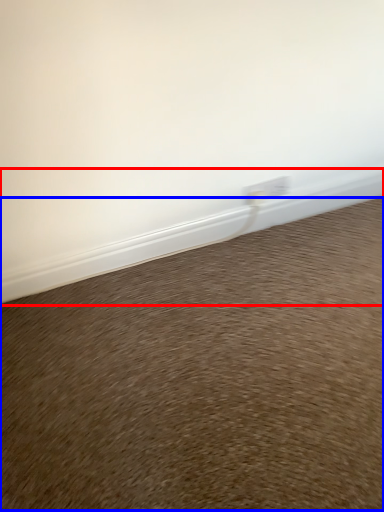
Question: Which object is further to the camera taking this photo, window sill (highlighted by a red box) or sand (highlighted by a blue box)?

Choices:
 (A) window sill
 (B) sand

Answer: (A)